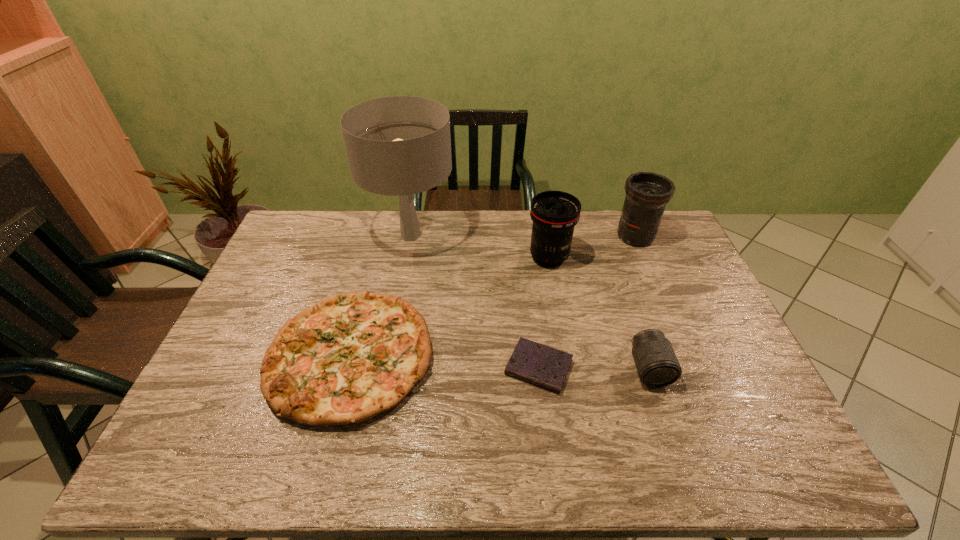
Locate which telephoto lens is the closest to the tallest object. Please provide its 2D coordinates. Your answer should be formatted as a tuple, i.e. [(x, y)], where the tuple contains the x and y coordinates of a point satisfying the conditions above.

[(554, 214)]